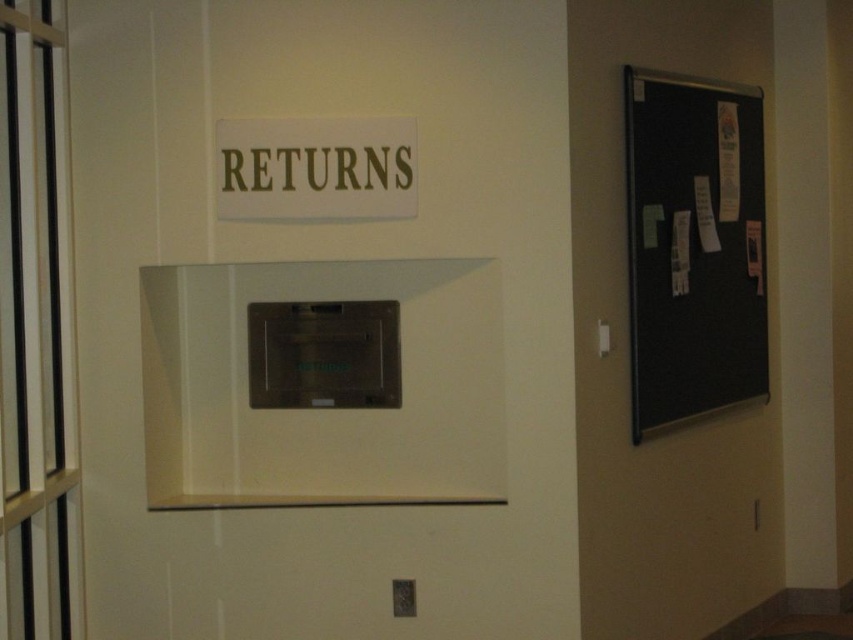
Does satin black oven at center have a greater height compared to brown metallic returns at upper center?

Yes, satin black oven at center is taller than brown metallic returns at upper center.

Is point (305, 404) positioned in front of point (280, 148)?

No, it is behind (280, 148).

The image size is (853, 640). Identify the location of satin black oven at center. (323, 355).

Locate an element on the screen. This screenshot has height=640, width=853. satin black oven at center is located at coordinates (323, 355).

Who is positioned more to the left, black feltboard at right or gold metallic sign at upper center?

Positioned to the left is gold metallic sign at upper center.

Describe the element at coordinates (693, 246) in the screenshot. I see `black feltboard at right` at that location.

What do you see at coordinates (693, 246) in the screenshot? I see `black feltboard at right` at bounding box center [693, 246].

The width and height of the screenshot is (853, 640). In order to click on black feltboard at right in this screenshot , I will do `click(693, 246)`.

Does point (648, 189) come behind point (389, 180)?

Yes, it is behind point (389, 180).

Is black feltboard at right wider than brown metallic returns at upper center?

Yes.

Is point (653, 90) positioned after point (244, 182)?

Yes.

This screenshot has width=853, height=640. I want to click on black feltboard at right, so click(693, 246).